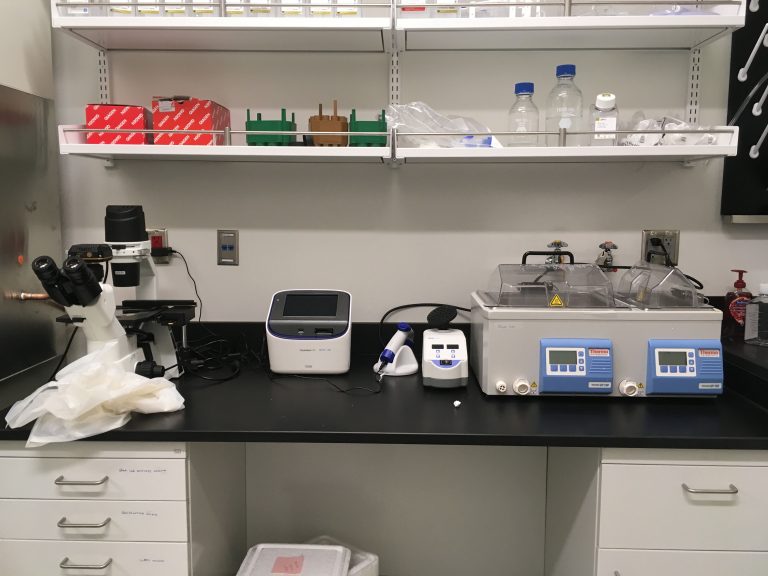
Locate an element on the screen. digital screens is located at coordinates (303, 297), (561, 353), (676, 359).